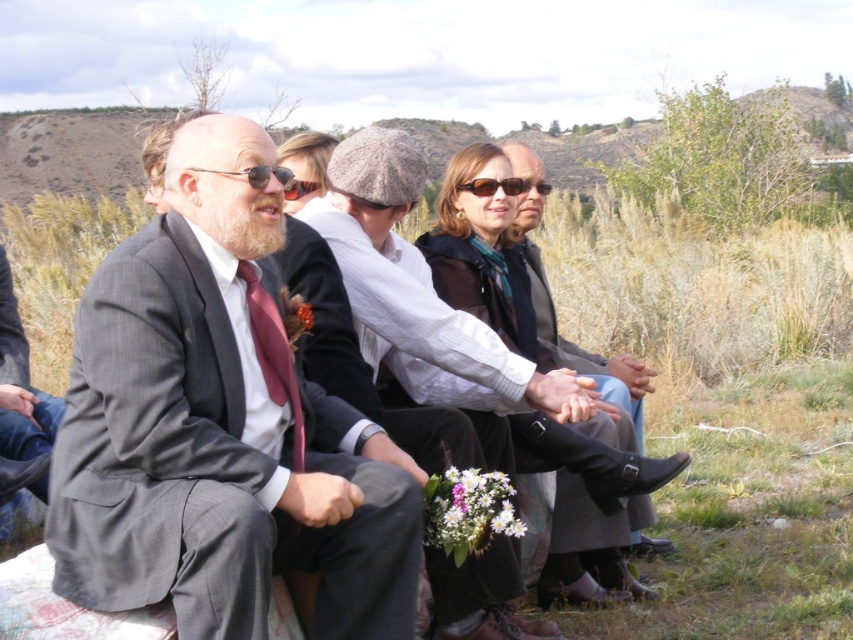
Question: Among these objects, which one is farthest from the camera?

Choices:
 (A) leather boots at center
 (B) sunglasses at center
 (C) matte brown sunglasses at center

Answer: (B)

Question: Which object is the farthest from the matte gray suit at left?

Choices:
 (A) matte burgundy tie at left
 (B) leather boots at center

Answer: (B)

Question: Which point is closer to the camera taking this photo?

Choices:
 (A) (265, 168)
 (B) (520, 177)

Answer: (A)

Question: In this image, where is leather boots at center located relative to matte brown sunglasses at center?

Choices:
 (A) right
 (B) left

Answer: (A)

Question: Does matte gray suit at left appear over sunglasses at center?

Choices:
 (A) no
 (B) yes

Answer: (A)

Question: Is leather boots at center smaller than matte brown sunglasses at center?

Choices:
 (A) no
 (B) yes

Answer: (A)